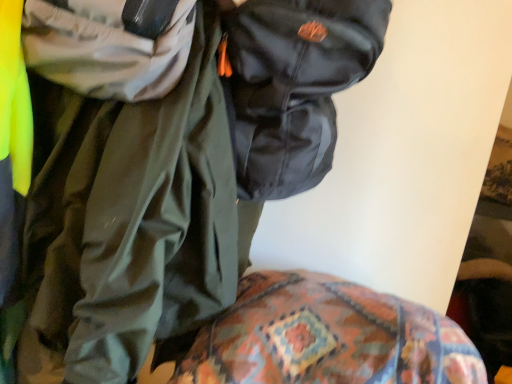
What do you see at coordinates (327, 337) in the screenshot? This screenshot has width=512, height=384. I see `patterned fabric at lower center` at bounding box center [327, 337].

The width and height of the screenshot is (512, 384). I want to click on patterned fabric at lower center, so 327,337.

You are a GUI agent. You are given a task and a screenshot of the screen. Output one action in this format:
    pyautogui.click(x=<x>, y=<y>)
    Task: Click on the backpack above the patterned fabric at lower center (from a real-world perspective)
    Image resolution: width=512 pixels, height=384 pixels.
    Given the screenshot: What is the action you would take?
    pyautogui.click(x=294, y=85)

Is patterned fabric at lower center facing towards glossy black backpack at upper center?

No, patterned fabric at lower center is not aimed at glossy black backpack at upper center.

Does patterned fabric at lower center have a larger size compared to glossy black backpack at upper center?

Yes.

Between patterned fabric at lower center and glossy black backpack at upper center, which one has less height?

With less height is patterned fabric at lower center.

Based on the photo, is glossy black backpack at upper center oriented towards patterned fabric at lower center?

No, glossy black backpack at upper center is not turned towards patterned fabric at lower center.

Is point (234, 142) behind point (295, 369)?

Yes.

In terms of width, does glossy black backpack at upper center look wider or thinner when compared to patterned fabric at lower center?

Clearly, glossy black backpack at upper center has less width compared to patterned fabric at lower center.

From a real-world perspective, is glossy black backpack at upper center over patterned fabric at lower center?

Indeed, from a real-world perspective, glossy black backpack at upper center stands above patterned fabric at lower center.

In order to click on backpack on the right of shiny black jacket at upper center in this screenshot , I will do `click(294, 85)`.

Is point (296, 37) closer or farther from the camera than point (83, 178)?

Point (296, 37) is closer to the camera than point (83, 178).

From a real-world perspective, is glossy black backpack at upper center positioned over shiny black jacket at upper center based on gravity?

Indeed, from a real-world perspective, glossy black backpack at upper center stands above shiny black jacket at upper center.

Does glossy black backpack at upper center have a greater width compared to shiny black jacket at upper center?

No, glossy black backpack at upper center is not wider than shiny black jacket at upper center.

Is shiny black jacket at upper center surrounding glossy black backpack at upper center?

Yes, glossy black backpack at upper center is inside shiny black jacket at upper center.

How many degrees apart are the facing directions of shiny black jacket at upper center and glossy black backpack at upper center?

The angle between the facing direction of shiny black jacket at upper center and the facing direction of glossy black backpack at upper center is 0.00085 degrees.

Does shiny black jacket at upper center come behind glossy black backpack at upper center?

No, the depth of shiny black jacket at upper center is less than that of glossy black backpack at upper center.

Does point (22, 35) come farther from viewer compared to point (342, 0)?

Yes, it is behind point (342, 0).

Does point (86, 248) come farther from viewer compared to point (255, 323)?

That is False.

Considering the sizes of objects shiny black jacket at upper center and patterned fabric at lower center in the image provided, who is smaller, shiny black jacket at upper center or patterned fabric at lower center?

With smaller size is patterned fabric at lower center.

From the picture: Is shiny black jacket at upper center thinner than patterned fabric at lower center?

Answer: Yes, shiny black jacket at upper center is thinner than patterned fabric at lower center.

Is shiny black jacket at upper center positioned with its back to patterned fabric at lower center?

No, shiny black jacket at upper center is not facing away from patterned fabric at lower center.

Between patterned fabric at lower center and shiny black jacket at upper center, which one has smaller width?

shiny black jacket at upper center.

How distant is patterned fabric at lower center from shiny black jacket at upper center?

patterned fabric at lower center is 8.80 inches away from shiny black jacket at upper center.

Image resolution: width=512 pixels, height=384 pixels. I want to click on bedding to the right of shiny black jacket at upper center, so click(327, 337).

Could you tell me if patterned fabric at lower center is facing shiny black jacket at upper center?

No, patterned fabric at lower center is not oriented towards shiny black jacket at upper center.

What are the coordinates of `bedding lying on the right of glossy black backpack at upper center` in the screenshot? It's located at (327, 337).

The image size is (512, 384). I want to click on backpack above the patterned fabric at lower center (from a real-world perspective), so click(x=294, y=85).

From the image, which object appears to be farther from glossy black backpack at upper center, shiny black jacket at upper center or patterned fabric at lower center?

patterned fabric at lower center.

Based on their spatial positions, is glossy black backpack at upper center or shiny black jacket at upper center closer to patterned fabric at lower center?

shiny black jacket at upper center lies closer to patterned fabric at lower center than the other object.

Looking at the image, which one is located further to shiny black jacket at upper center, patterned fabric at lower center or glossy black backpack at upper center?

patterned fabric at lower center is positioned further to the anchor shiny black jacket at upper center.

Based on their spatial positions, is glossy black backpack at upper center or patterned fabric at lower center further from shiny black jacket at upper center?

The object further to shiny black jacket at upper center is patterned fabric at lower center.

Considering their positions, is patterned fabric at lower center positioned further to glossy black backpack at upper center than shiny black jacket at upper center?

patterned fabric at lower center.

Based on their spatial positions, is shiny black jacket at upper center or glossy black backpack at upper center further from patterned fabric at lower center?

glossy black backpack at upper center lies further to patterned fabric at lower center than the other object.

I want to click on jacket between glossy black backpack at upper center and patterned fabric at lower center in the vertical direction, so click(125, 189).